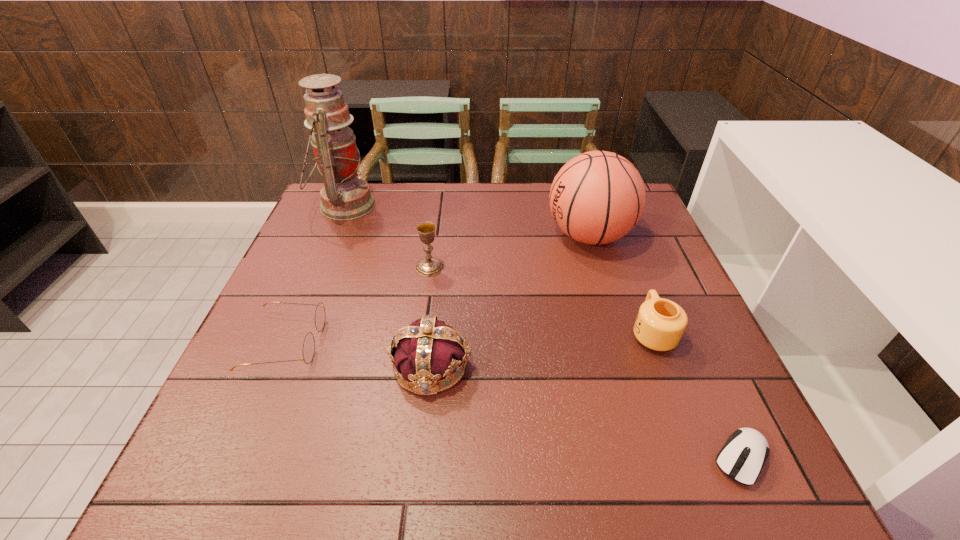
In the image, there is a desktop. What are the coordinates of `vacant space at the far edge` in the screenshot? It's located at (450, 184).

In the image, there is a desktop. At what (x,y) coordinates should I click in order to perform the action: click on blank space at the near edge. Please return your answer as a coordinate pair (x, y). The image size is (960, 540). Looking at the image, I should click on (489, 449).

In the image, there is a desktop. Where is `blank space at the left edge`? blank space at the left edge is located at coordinates (273, 356).

Where is `free spot at the right edge of the desktop`? The height and width of the screenshot is (540, 960). free spot at the right edge of the desktop is located at coordinates (687, 300).

Locate an element on the screen. Image resolution: width=960 pixels, height=540 pixels. empty location between the oil lamp and the crown is located at coordinates (388, 286).

The image size is (960, 540). In order to click on empty location between the chalice and the spectacles in this screenshot , I will do `click(358, 305)`.

You are a GUI agent. You are given a task and a screenshot of the screen. Output one action in this format:
    pyautogui.click(x=<x>, y=<y>)
    Task: Click on the empty space that is in between the spectacles and the basketball
    The width and height of the screenshot is (960, 540).
    Given the screenshot: What is the action you would take?
    pyautogui.click(x=438, y=289)

The image size is (960, 540). In order to click on free space between the basketball and the chalice in this screenshot , I will do `click(509, 252)`.

You are a GUI agent. You are given a task and a screenshot of the screen. Output one action in this format:
    pyautogui.click(x=<x>, y=<y>)
    Task: Click on the free area in between the spectacles and the nearest object
    
    Given the screenshot: What is the action you would take?
    pyautogui.click(x=514, y=400)

This screenshot has height=540, width=960. I want to click on empty location between the crown and the spectacles, so click(359, 354).